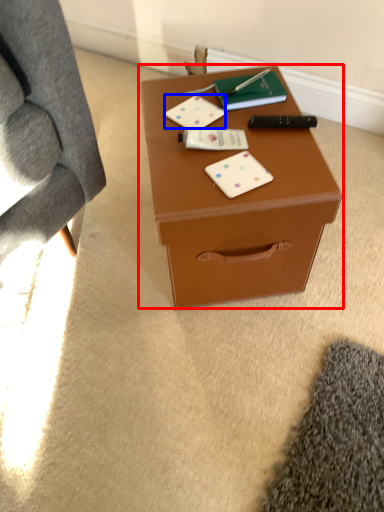
Question: Which object is further to the camera taking this photo, table (highlighted by a red box) or card game (highlighted by a blue box)?

Choices:
 (A) table
 (B) card game

Answer: (B)